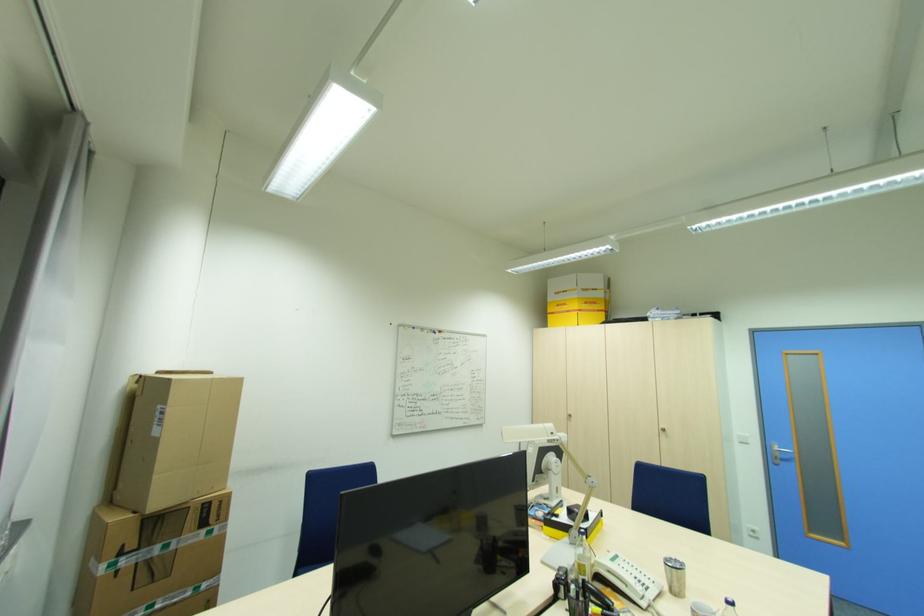
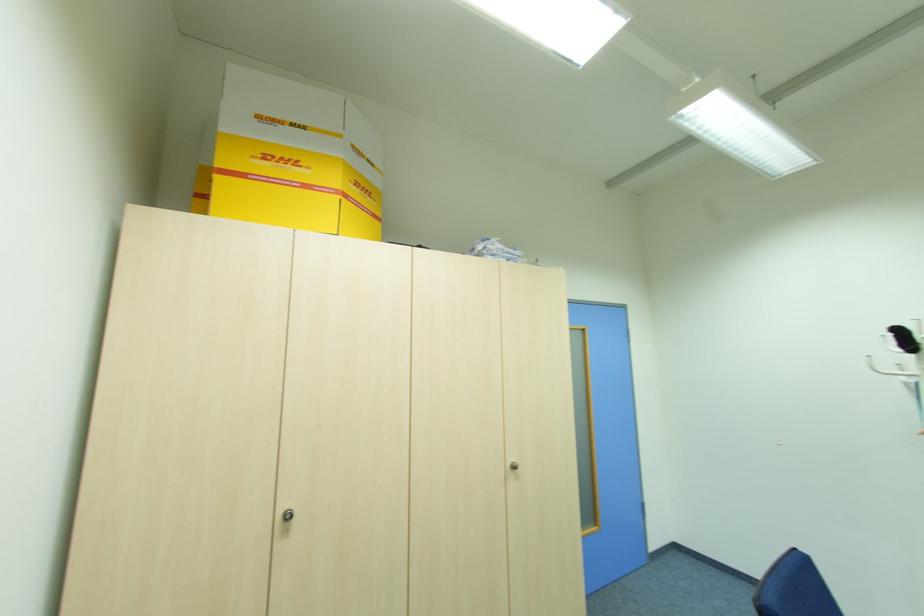
Question: I am providing you with two images of the same scene from different viewpoints. Please identify which objects are invisible in image2.

Choices:
 (A) cabinet door lock
 (B) yellow DHL box
 (C) white coat hook
 (D) none of these

Answer: (D)